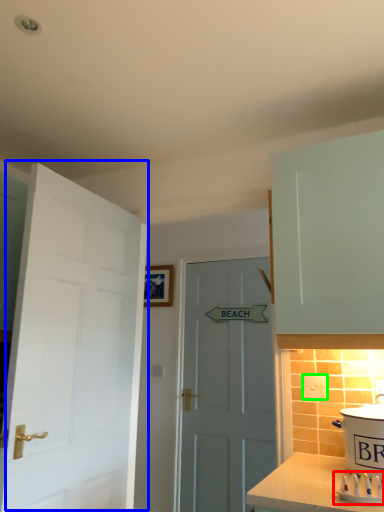
Question: Which object is positioned farthest from appliance (highlighted by a red box)? Select from door (highlighted by a blue box) and electric outlet (highlighted by a green box).

Choices:
 (A) door
 (B) electric outlet

Answer: (A)